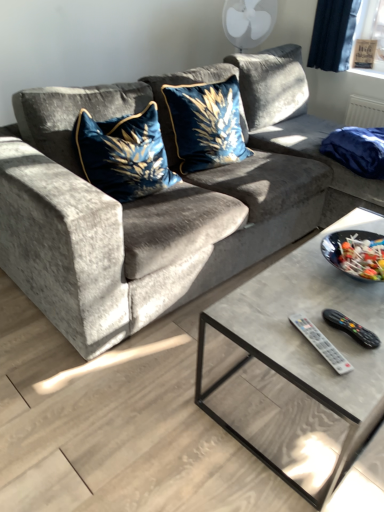
Question: From a real-world perspective, does velvet blue pillow at upper right stand above velvet blue pillow at center, the first throw pillow from the left?

Choices:
 (A) yes
 (B) no

Answer: (B)

Question: Can you confirm if velvet blue pillow at upper right is positioned to the right of velvet blue pillow at center, which is the 2th throw pillow from right to left?

Choices:
 (A) yes
 (B) no

Answer: (A)

Question: Is velvet blue pillow at upper right not within velvet blue pillow at center, the first throw pillow from the left?

Choices:
 (A) no
 (B) yes

Answer: (B)

Question: From the image's perspective, is velvet blue pillow at upper right located above velvet blue pillow at center, the first throw pillow from the left?

Choices:
 (A) no
 (B) yes

Answer: (B)

Question: Does velvet blue pillow at upper right have a greater height compared to velvet blue pillow at center, the first throw pillow from the left?

Choices:
 (A) no
 (B) yes

Answer: (A)

Question: In terms of height, does black plastic remote at lower right, marked as the second remote in a left-to-right arrangement, look taller or shorter compared to velvet blue pillow at upper right?

Choices:
 (A) tall
 (B) short

Answer: (B)

Question: In terms of size, does black plastic remote at lower right, which is counted as the first remote, starting from the right, appear bigger or smaller than velvet blue pillow at upper right?

Choices:
 (A) big
 (B) small

Answer: (B)

Question: Visually, is black plastic remote at lower right, marked as the second remote in a left-to-right arrangement, positioned to the left or to the right of velvet blue pillow at upper right?

Choices:
 (A) right
 (B) left

Answer: (B)

Question: Is black plastic remote at lower right, which is counted as the first remote, starting from the right, spatially inside velvet blue pillow at upper right, or outside of it?

Choices:
 (A) outside
 (B) inside

Answer: (A)

Question: In the image, is velvet blue pillow at center, the first throw pillow from the left, on the left side or the right side of black plastic remote at lower right, marked as the second remote in a left-to-right arrangement?

Choices:
 (A) left
 (B) right

Answer: (A)

Question: From a real-world perspective, is velvet blue pillow at center, the first throw pillow from the left, physically located above or below black plastic remote at lower right, marked as the second remote in a left-to-right arrangement?

Choices:
 (A) below
 (B) above

Answer: (B)

Question: In terms of height, does velvet blue pillow at center, the first throw pillow from the left, look taller or shorter compared to black plastic remote at lower right, which is counted as the first remote, starting from the right?

Choices:
 (A) short
 (B) tall

Answer: (B)

Question: Looking at their shapes, would you say velvet blue pillow at center, the first throw pillow from the left, is wider or thinner than black plastic remote at lower right, marked as the second remote in a left-to-right arrangement?

Choices:
 (A) thin
 (B) wide

Answer: (B)

Question: Considering the positions of velvet gray couch at center and velvet blue cushion at center, arranged as the second throw pillow when viewed from the left, in the image, is velvet gray couch at center bigger or smaller than velvet blue cushion at center, arranged as the second throw pillow when viewed from the left,?

Choices:
 (A) small
 (B) big

Answer: (B)

Question: Is velvet gray couch at center spatially inside velvet blue cushion at center, arranged as the second throw pillow when viewed from the left, or outside of it?

Choices:
 (A) inside
 (B) outside

Answer: (B)